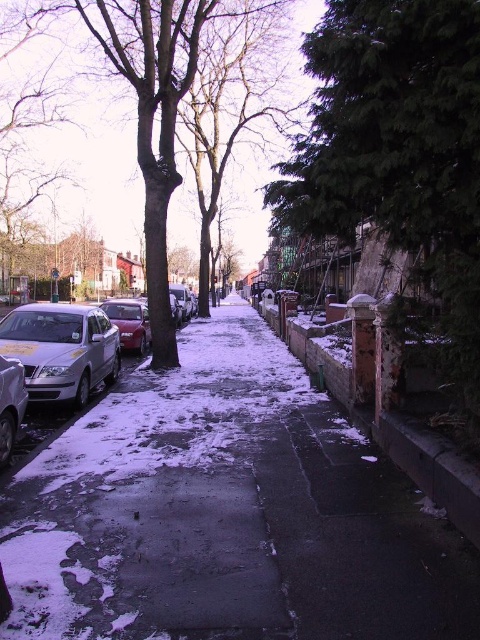
You are standing at the center of the residential street. You want to walk to the silver metallic car at left. Which direction should you walk to reach it?

The silver metallic car at left is located at point (61, 349), so you should walk towards the left side of the street to reach it.

You are standing on the sidewalk in the scene and see a silver metallic car at lower left. There is a point marked at coordinates (11, 404). Is this point located on the silver metallic car?

Yes, the point at coordinates (11, 404) is located on the silver metallic car at lower left as stated in the description.

You are standing at the center of the residential street. There is a point labeled as point (232, 100). What does this point represent?

The point (232, 100) corresponds to the bare branches at center.